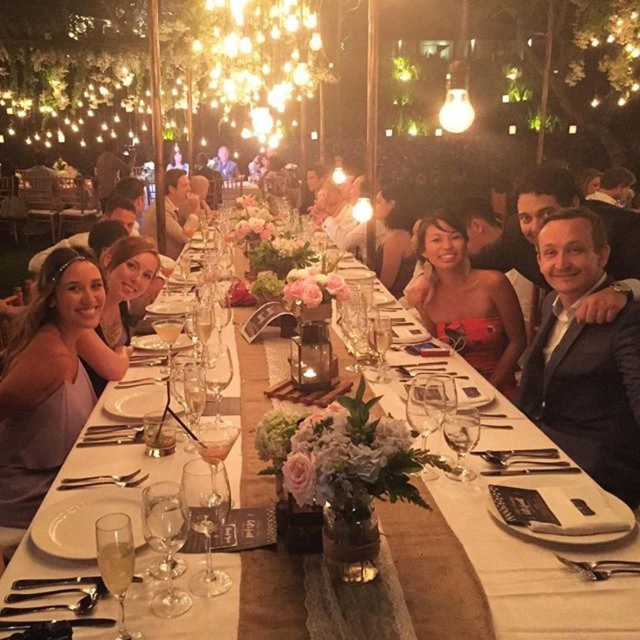
Between black suit at right and matte purple dress at left, which one has less height?

matte purple dress at left

Can you confirm if black suit at right is taller than matte purple dress at left?

Correct, black suit at right is much taller as matte purple dress at left.

The image size is (640, 640). Find the location of `black suit at right`. black suit at right is located at coordinates click(x=584, y=358).

Is black suit at right bigger than white ceramic plate at center?

Yes, black suit at right is bigger than white ceramic plate at center.

Can you confirm if black suit at right is shorter than white ceramic plate at center?

No.

Which is in front, point (621, 387) or point (140, 509)?

Point (140, 509)

The height and width of the screenshot is (640, 640). What are the coordinates of `black suit at right` in the screenshot? It's located at (584, 358).

Which of these two, matte purple dress at left or matte red dress at center, stands shorter?

matte red dress at center

Is point (77, 298) positioned before point (452, 285)?

Yes, point (77, 298) is in front of point (452, 285).

Find the location of a particular element. matte purple dress at left is located at coordinates (49, 384).